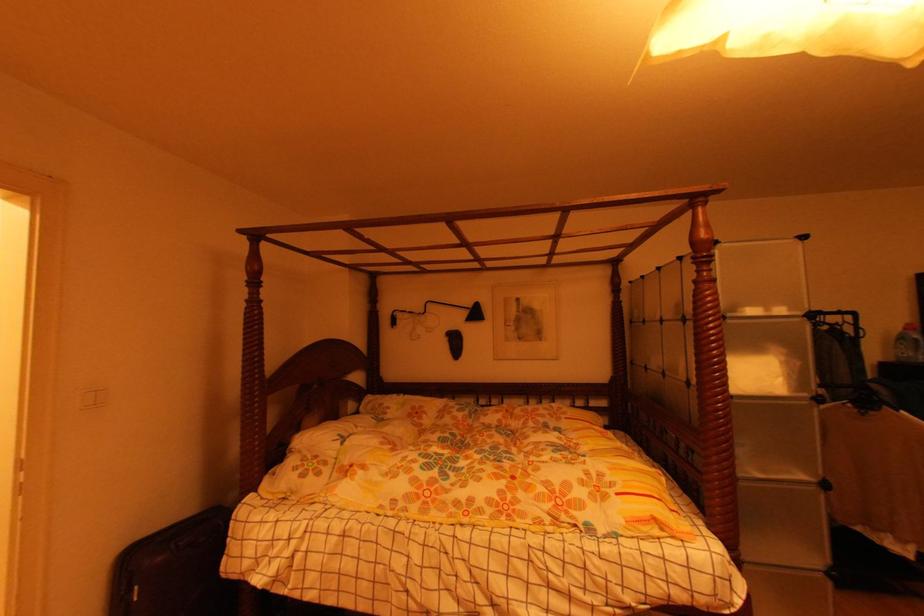
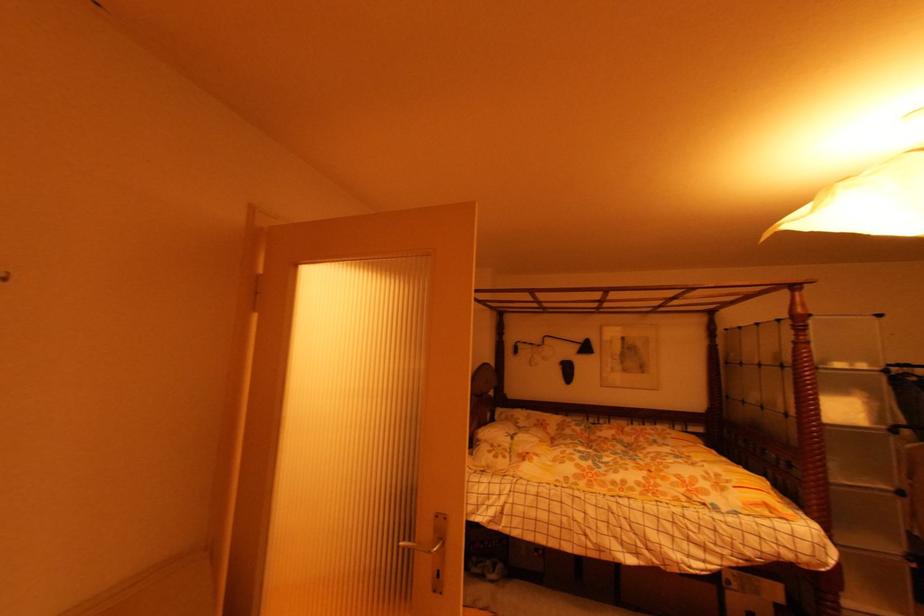
Based on the photo, which direction would the cameraman need to move to produce the second image?

The cameraman walked toward left, backward.